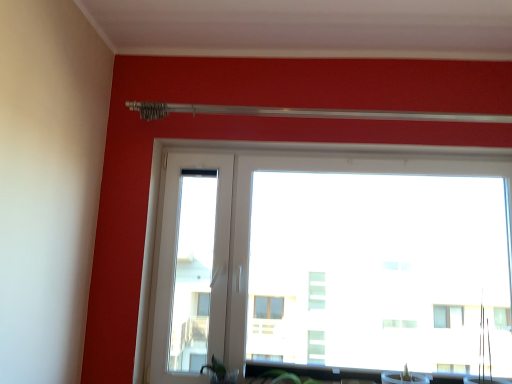
Question: From a real-world perspective, is transparent glass window at center physically located above or below green matte plant at lower center?

Choices:
 (A) below
 (B) above

Answer: (B)

Question: In terms of size, does transparent glass window at center appear bigger or smaller than green matte plant at lower center?

Choices:
 (A) big
 (B) small

Answer: (A)

Question: Is transparent glass window at center inside or outside of green matte plant at lower center?

Choices:
 (A) inside
 (B) outside

Answer: (B)

Question: Is green matte plant at lower center taller or shorter than transparent glass window at center?

Choices:
 (A) short
 (B) tall

Answer: (A)

Question: From the image's perspective, is green matte plant at lower center located above or below transparent glass window at center?

Choices:
 (A) below
 (B) above

Answer: (A)

Question: Is green matte plant at lower center in front of or behind transparent glass window at center in the image?

Choices:
 (A) behind
 (B) front

Answer: (B)

Question: Choose the correct answer: Is green matte plant at lower center inside transparent glass window at center or outside it?

Choices:
 (A) outside
 (B) inside

Answer: (A)